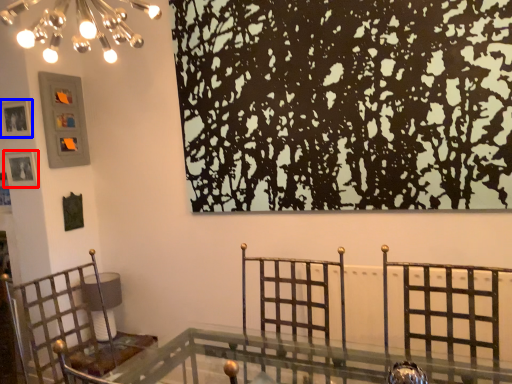
Question: Among these objects, which one is nearest to the camera, picture frame (highlighted by a red box) or picture frame (highlighted by a blue box)?

Choices:
 (A) picture frame
 (B) picture frame

Answer: (B)